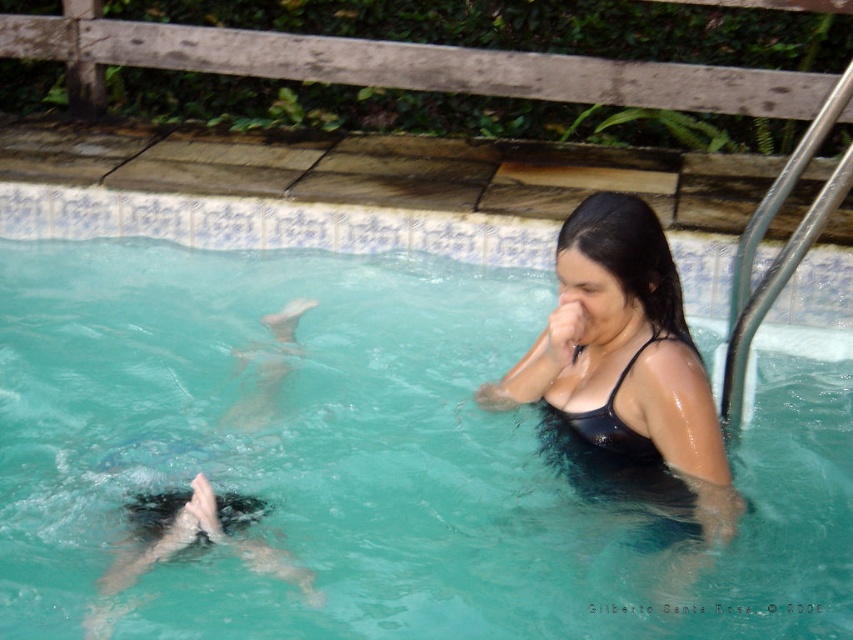
Question: Can you confirm if black matte swimsuit at upper right is bigger than black matte bikini top at upper right?

Choices:
 (A) yes
 (B) no

Answer: (A)

Question: Does black matte swimsuit at upper right appear over black matte bikini top at upper right?

Choices:
 (A) yes
 (B) no

Answer: (A)

Question: Which point is closer to the camera?

Choices:
 (A) black matte swimsuit at upper right
 (B) clear plastic water at center
 (C) black matte bikini top at upper right

Answer: (A)

Question: Can you confirm if black matte swimsuit at upper right is thinner than black matte bikini top at upper right?

Choices:
 (A) no
 (B) yes

Answer: (A)

Question: Which point is farther to the camera?

Choices:
 (A) (619, 426)
 (B) (599, 278)

Answer: (A)

Question: Which point appears closest to the camera in this image?

Choices:
 (A) (688, 342)
 (B) (160, 307)
 (C) (683, 467)

Answer: (C)